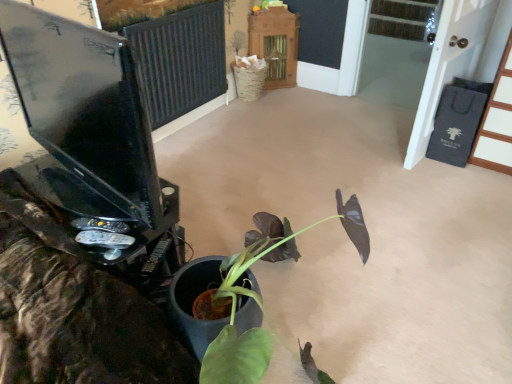
Question: Would you say matte black monitor at left contains wooden cabinet at upper center, arranged as the 2th furniture when viewed from the right?

Choices:
 (A) yes
 (B) no

Answer: (B)

Question: From a real-world perspective, is matte black monitor at left positioned under wooden cabinet at upper center, arranged as the 2th furniture when viewed from the right, based on gravity?

Choices:
 (A) no
 (B) yes

Answer: (A)

Question: From the image's perspective, is matte black monitor at left over wooden cabinet at upper center, positioned as the 2th furniture in front-to-back order?

Choices:
 (A) no
 (B) yes

Answer: (A)

Question: Is matte black monitor at left taller than wooden cabinet at upper center, positioned as the 2th furniture in front-to-back order?

Choices:
 (A) yes
 (B) no

Answer: (B)

Question: Can you confirm if matte black monitor at left is shorter than wooden cabinet at upper center, positioned as the 2th furniture in front-to-back order?

Choices:
 (A) yes
 (B) no

Answer: (A)

Question: Is matte black monitor at left further to camera compared to wooden cabinet at upper center, arranged as the 2th furniture when viewed from the right?

Choices:
 (A) yes
 (B) no

Answer: (B)

Question: Is wooden cabinet at upper center, positioned as the 2th furniture in front-to-back order, beside black wood door at upper right, the 1th furniture in the right-to-left sequence?

Choices:
 (A) yes
 (B) no

Answer: (B)

Question: From the image's perspective, is wooden cabinet at upper center, arranged as the 2th furniture when viewed from the right, under black wood door at upper right, which is the second furniture from back to front?

Choices:
 (A) yes
 (B) no

Answer: (B)

Question: Considering the relative sizes of wooden cabinet at upper center, arranged as the 2th furniture when viewed from the right, and black wood door at upper right, the first furniture from the front, in the image provided, is wooden cabinet at upper center, arranged as the 2th furniture when viewed from the right, thinner than black wood door at upper right, the first furniture from the front,?

Choices:
 (A) yes
 (B) no

Answer: (A)

Question: Does wooden cabinet at upper center, arranged as the 2th furniture when viewed from the right, contain black wood door at upper right, the first furniture from the front?

Choices:
 (A) no
 (B) yes

Answer: (A)

Question: Can you confirm if wooden cabinet at upper center, arranged as the first furniture when viewed from the left, is bigger than black wood door at upper right, the 1th furniture in the right-to-left sequence?

Choices:
 (A) yes
 (B) no

Answer: (B)

Question: Is wooden cabinet at upper center, arranged as the 2th furniture when viewed from the right, positioned before black wood door at upper right, placed as the second furniture when sorted from left to right?

Choices:
 (A) no
 (B) yes

Answer: (A)

Question: Can you confirm if wooden cabinet at upper center, marked as the 1th furniture in a back-to-front arrangement, is shorter than black fabric screen door at right?

Choices:
 (A) yes
 (B) no

Answer: (A)